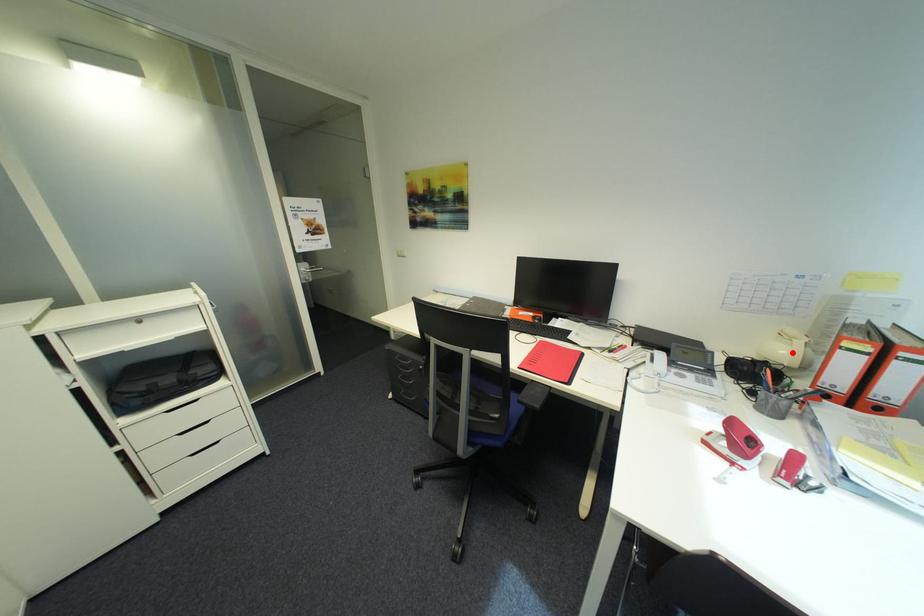
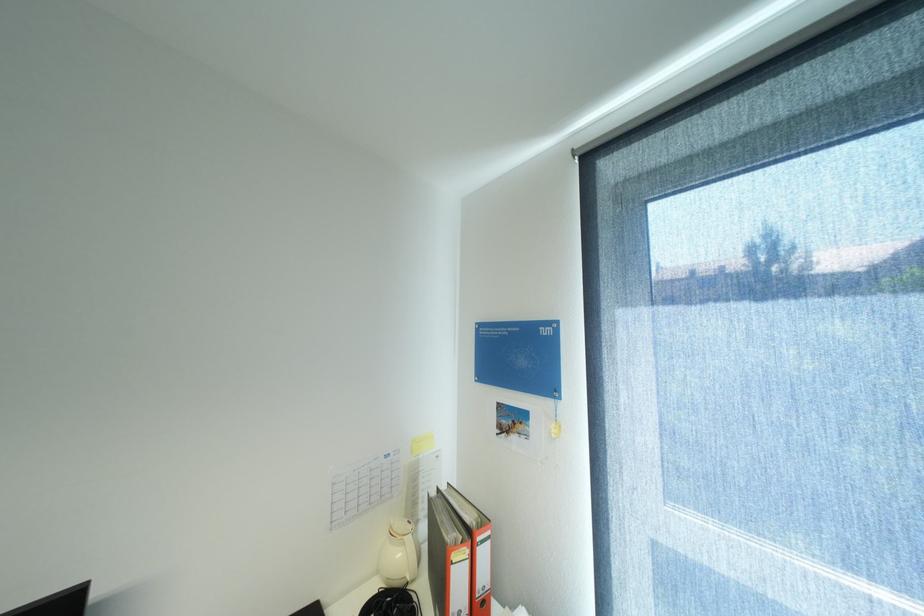
Locate, in the second image, the point that corresponds to the highlighted location in the first image.

(407, 554)